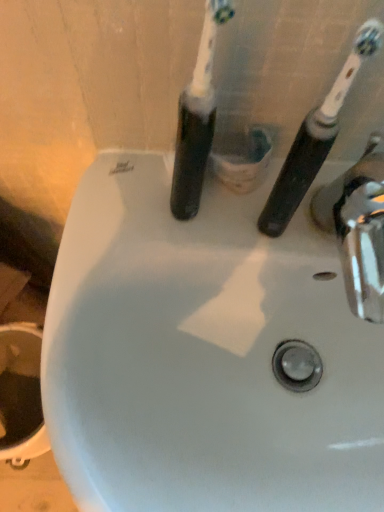
Where is `free space between black plastic toothbrush at center, arranged as the 2th toothbrush when viewed from the right, and chrome metallic tap at right`? free space between black plastic toothbrush at center, arranged as the 2th toothbrush when viewed from the right, and chrome metallic tap at right is located at coordinates (236, 228).